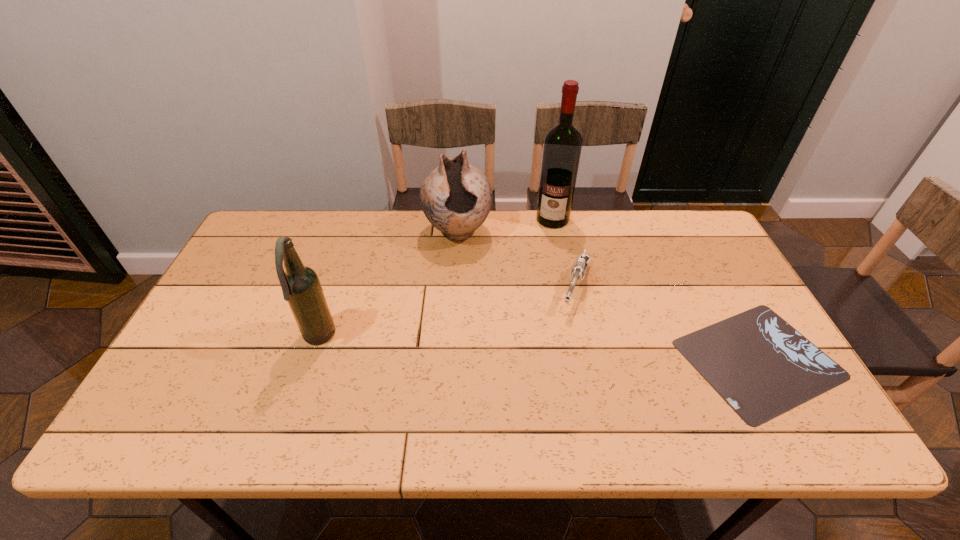
Where is `beer bottle`? beer bottle is located at coordinates (301, 287).

This screenshot has width=960, height=540. Identify the location of mousepad. (758, 363).

Identify the location of the rightmost object. (758, 363).

Where is `alcohol`? alcohol is located at coordinates (562, 147).

Where is `the second shortest object`? The image size is (960, 540). the second shortest object is located at coordinates (578, 271).

Where is `the second object from left to right`? the second object from left to right is located at coordinates (456, 198).

Identify the location of free space located 0.070m on the back of the leftmost object. [x=330, y=302].

The image size is (960, 540). Identify the location of free location located 0.260m on the left of the shortest object. (573, 359).

In order to click on free region located on the front and back of the alcohol in this screenshot , I will do `click(541, 262)`.

At what (x,y) coordinates should I click in order to perform the action: click on free location located on the front and back of the alcohol. Please return your answer as a coordinate pair (x, y). The image size is (960, 540). Looking at the image, I should click on (540, 264).